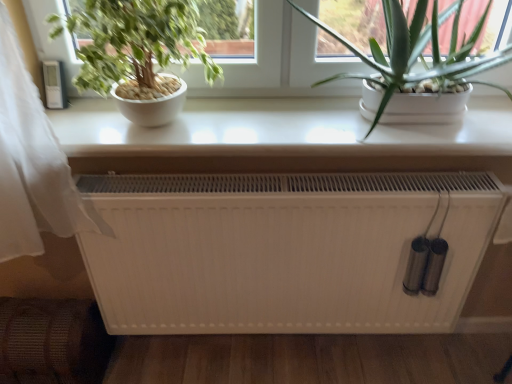
Question: Can you confirm if green matte plant at left, which appears as the first houseplant when viewed from the left, is smaller than white glossy table at upper center?

Choices:
 (A) yes
 (B) no

Answer: (B)

Question: From the image's perspective, is green matte plant at left, which appears as the first houseplant when viewed from the left, below white glossy table at upper center?

Choices:
 (A) yes
 (B) no

Answer: (B)

Question: From a real-world perspective, is green matte plant at left, the 2th houseplant from the right, located higher than white glossy table at upper center?

Choices:
 (A) yes
 (B) no

Answer: (A)

Question: Considering the relative sizes of green matte plant at left, the 2th houseplant from the right, and white glossy table at upper center in the image provided, is green matte plant at left, the 2th houseplant from the right, bigger than white glossy table at upper center?

Choices:
 (A) no
 (B) yes

Answer: (B)

Question: Is green matte plant at left, which appears as the first houseplant when viewed from the left, to the right of white glossy table at upper center from the viewer's perspective?

Choices:
 (A) yes
 (B) no

Answer: (B)

Question: Is green matte plant at left, the 2th houseplant from the right, shorter than white glossy table at upper center?

Choices:
 (A) yes
 (B) no

Answer: (B)

Question: Are green matte plant at left, which appears as the first houseplant when viewed from the left, and white matte heater at center beside each other?

Choices:
 (A) yes
 (B) no

Answer: (B)

Question: Can you confirm if green matte plant at left, which appears as the first houseplant when viewed from the left, is bigger than white matte heater at center?

Choices:
 (A) yes
 (B) no

Answer: (B)

Question: Is green matte plant at left, which appears as the first houseplant when viewed from the left, taller than white matte heater at center?

Choices:
 (A) yes
 (B) no

Answer: (B)

Question: From a real-world perspective, is green matte plant at left, the 2th houseplant from the right, under white matte heater at center?

Choices:
 (A) yes
 (B) no

Answer: (B)

Question: Considering the relative sizes of green matte plant at left, which appears as the first houseplant when viewed from the left, and white matte heater at center in the image provided, is green matte plant at left, which appears as the first houseplant when viewed from the left, thinner than white matte heater at center?

Choices:
 (A) no
 (B) yes

Answer: (A)

Question: Considering the relative positions of green matte plant at left, the 2th houseplant from the right, and white matte heater at center in the image provided, is green matte plant at left, the 2th houseplant from the right, to the right of white matte heater at center from the viewer's perspective?

Choices:
 (A) yes
 (B) no

Answer: (B)

Question: Is white matte heater at center wider than green leafy plant at upper right, acting as the first houseplant starting from the right?

Choices:
 (A) yes
 (B) no

Answer: (B)